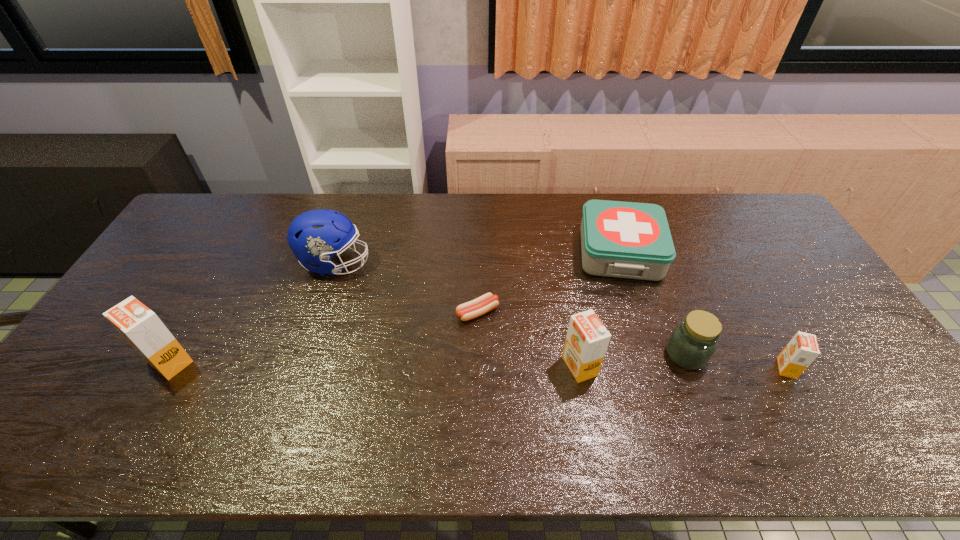
You are a GUI agent. You are given a task and a screenshot of the screen. Output one action in this format:
    pyautogui.click(x=<x>, y=<y>)
    Task: Click on the free space located on the back of the leftmost object
    
    Given the screenshot: What is the action you would take?
    pyautogui.click(x=225, y=266)

I want to click on blank space located on the back of the fourth object from right to left, so click(x=564, y=282).

Identify the location of vacant region located on the left of the shortest orange juice. (756, 368).

At what (x,y) coordinates should I click in order to perform the action: click on vacant area situated on the back of the sausage. Please return your answer as a coordinate pair (x, y). The width and height of the screenshot is (960, 540). Looking at the image, I should click on (478, 245).

Image resolution: width=960 pixels, height=540 pixels. Identify the location of vacant area situated 0.100m on the face guard of the second object from left to right. (402, 263).

What are the coordinates of `vacant space located 0.270m on the front of the first-aid kit` in the screenshot? It's located at (655, 361).

Identify the location of free location located on the left of the jar. (586, 355).

Locate an element on the screen. The height and width of the screenshot is (540, 960). object situated at the far edge is located at coordinates (631, 240).

At what (x,y) coordinates should I click in order to perform the action: click on object present at the left edge. Please return your answer as a coordinate pair (x, y). The width and height of the screenshot is (960, 540). Looking at the image, I should click on (141, 327).

Identify the location of object situated at the near left corner. This screenshot has height=540, width=960. (141, 327).